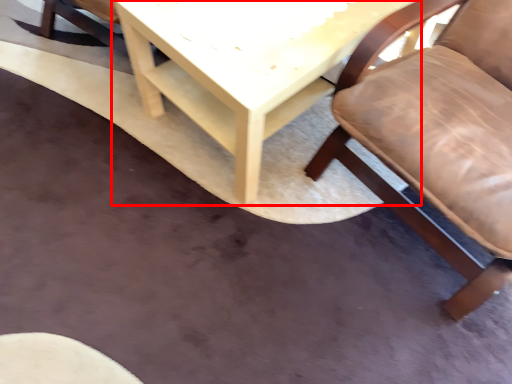
Question: From the image, what is the correct spatial relationship of table (annotated by the red box) in relation to chair?

Choices:
 (A) right
 (B) left

Answer: (B)